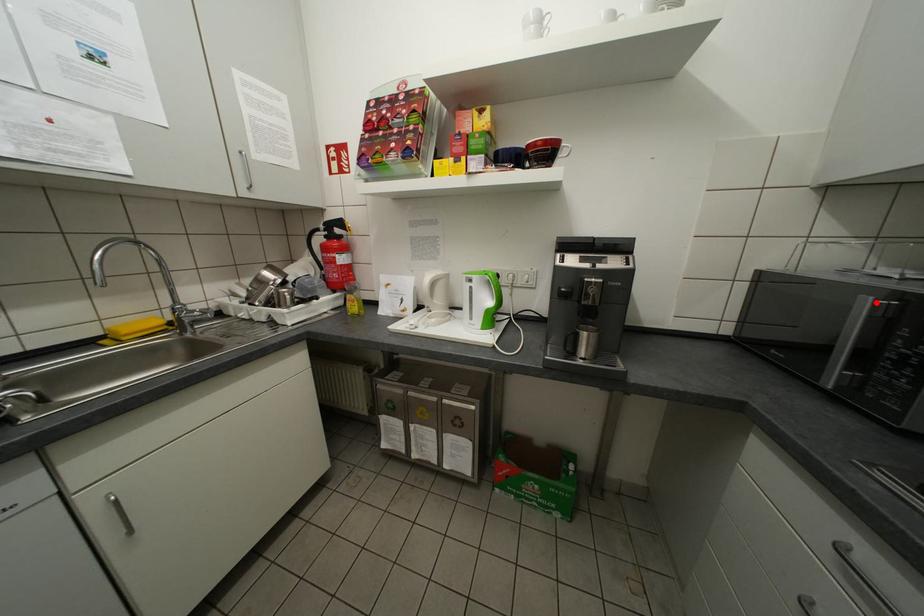
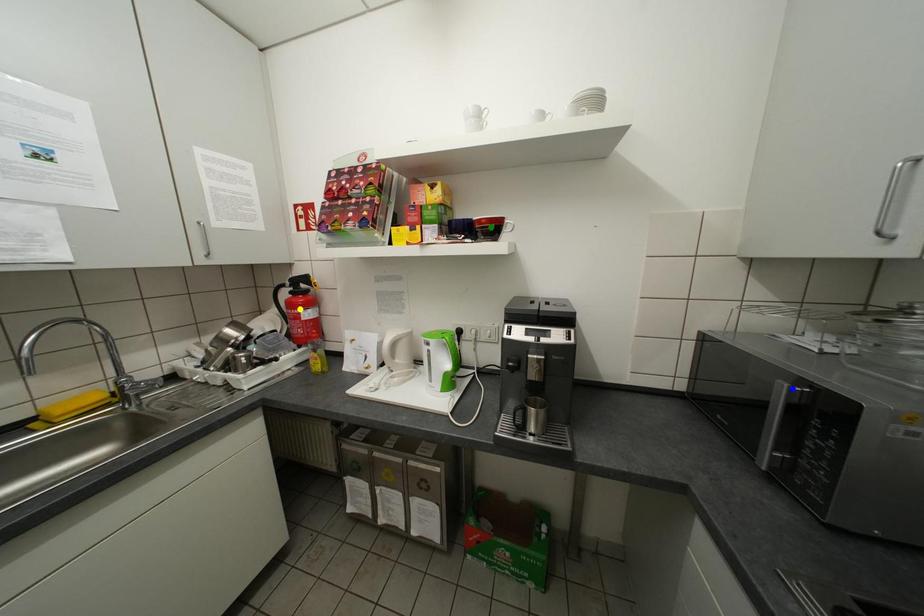
Question: I am providing you with two images of the same scene from different viewpoints. A red point is marked on the first image. You are given multiple points on the second image. Which point in image 2 represents the same 3d spot as the red point in image 1?

Choices:
 (A) blue point
 (B) green point
 (C) yellow point

Answer: (A)